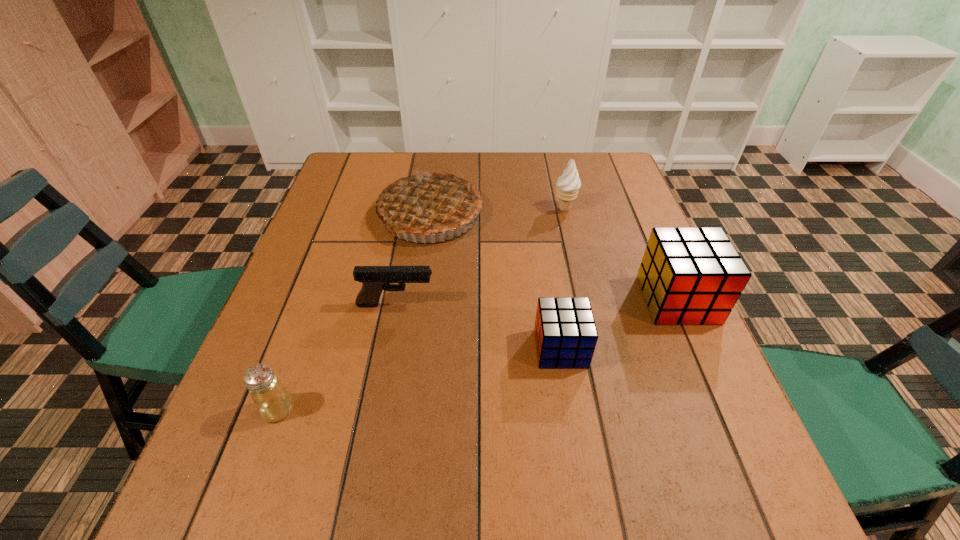
Find the location of a particular element. The image size is (960, 540). vacant point that satisfies the following two spatial constraints: 1. on the front side of the taller cube; 2. on the front-facing side of the pistol is located at coordinates (680, 305).

Where is `free space in the image that satisfies the following two spatial constraints: 1. on the front-facing side of the pistol; 2. on the front side of the leftmost object`? This screenshot has width=960, height=540. free space in the image that satisfies the following two spatial constraints: 1. on the front-facing side of the pistol; 2. on the front side of the leftmost object is located at coordinates (376, 409).